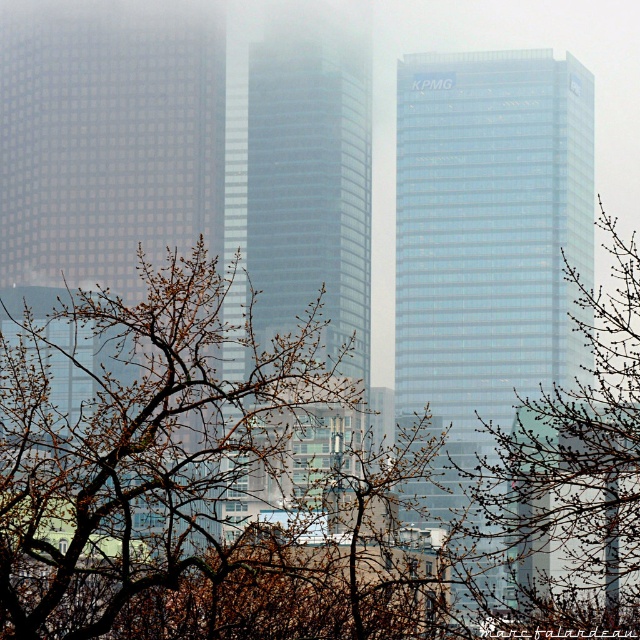
Describe the element at coordinates (292, 483) in the screenshot. This screenshot has width=640, height=640. I see `bare branches at center` at that location.

Looking at this image, does bare branches at center have a larger size compared to glassy blue skyscraper at center?

Indeed, bare branches at center has a larger size compared to glassy blue skyscraper at center.

Where is `bare branches at center`? This screenshot has width=640, height=640. bare branches at center is located at coordinates (292, 483).

Image resolution: width=640 pixels, height=640 pixels. In order to click on bare branches at center in this screenshot , I will do `click(292, 483)`.

Between transparent glass skyscraper at center and matte glass skyscraper at left, which one is positioned higher?

matte glass skyscraper at left is above.

Can you confirm if transparent glass skyscraper at center is positioned to the right of matte glass skyscraper at left?

Yes, transparent glass skyscraper at center is to the right of matte glass skyscraper at left.

Between point (545, 170) and point (108, 20), which one is positioned behind?

Point (108, 20)

The width and height of the screenshot is (640, 640). I want to click on transparent glass skyscraper at center, so click(486, 243).

Is transparent glass skyscraper at center shorter than glassy blue skyscraper at center?

In fact, transparent glass skyscraper at center may be taller than glassy blue skyscraper at center.

Describe the element at coordinates (486, 243) in the screenshot. The height and width of the screenshot is (640, 640). I see `transparent glass skyscraper at center` at that location.

Where is `transparent glass skyscraper at center`? Image resolution: width=640 pixels, height=640 pixels. transparent glass skyscraper at center is located at coordinates (486, 243).